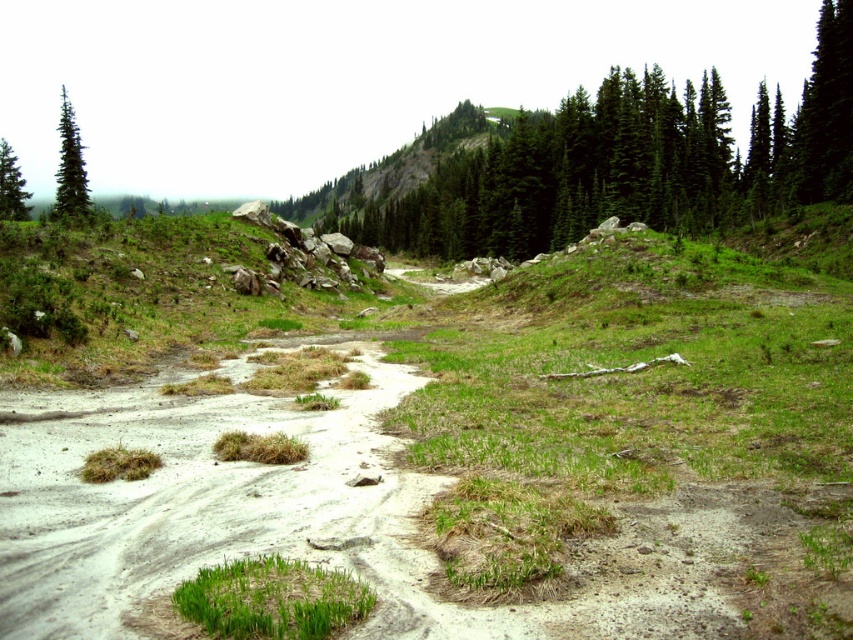
The image size is (853, 640). Describe the element at coordinates (271, 600) in the screenshot. I see `green grassy patch at lower center` at that location.

Is the position of green grassy patch at lower center less distant than that of green matte evergreen tree at upper left?

Yes.

Which is in front, point (257, 563) or point (82, 193)?

Point (257, 563)

At what (x,y) coordinates should I click in order to perform the action: click on green grassy patch at lower center. Please return your answer as a coordinate pair (x, y). This screenshot has height=640, width=853. Looking at the image, I should click on (271, 600).

Who is higher up, sandy/dry dirt track at lower left or green matte evergreen tree at upper left?

green matte evergreen tree at upper left

The image size is (853, 640). What do you see at coordinates (202, 500) in the screenshot?
I see `sandy/dry dirt track at lower left` at bounding box center [202, 500].

Locate an element on the screen. The image size is (853, 640). sandy/dry dirt track at lower left is located at coordinates (202, 500).

Is green grassy patch at lower center behind green matte tree at upper left?

No, green grassy patch at lower center is closer to the viewer.

Can you confirm if green grassy patch at lower center is positioned to the left of green matte tree at upper left?

No, green grassy patch at lower center is not to the left of green matte tree at upper left.

The width and height of the screenshot is (853, 640). Describe the element at coordinates (271, 600) in the screenshot. I see `green grassy patch at lower center` at that location.

At what (x,y) coordinates should I click in order to perform the action: click on green grassy patch at lower center. Please return your answer as a coordinate pair (x, y). Looking at the image, I should click on (271, 600).